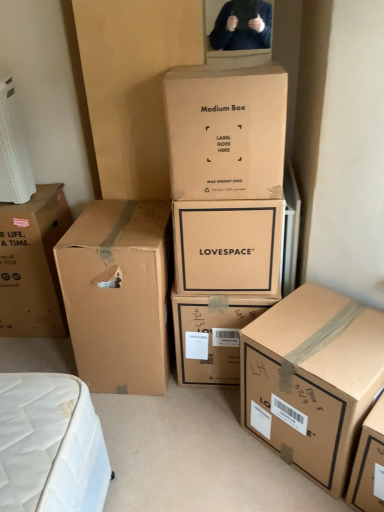
The image size is (384, 512). Identify the location of brown cardboard box at lower right, the 6th box from the left. (312, 380).

What do you see at coordinates (118, 294) in the screenshot? Image resolution: width=384 pixels, height=512 pixels. I see `brown cardboard box at left, arranged as the 2th box when viewed from the left` at bounding box center [118, 294].

Image resolution: width=384 pixels, height=512 pixels. Describe the element at coordinates (228, 246) in the screenshot. I see `matte cardboard box at center, the 4th box viewed from the left` at that location.

The width and height of the screenshot is (384, 512). Find the location of `matte brown box at center, which is the 5th box in left-to-right order`. matte brown box at center, which is the 5th box in left-to-right order is located at coordinates (212, 335).

This screenshot has height=512, width=384. I want to click on brown cardboard box at lower right, the 1th box from the right, so click(312, 380).

Considering the sizes of objects brown cardboard box at lower right, the 1th box from the right, and matte cardboard box at center, the 4th box viewed from the left, in the image provided, who is thinner, brown cardboard box at lower right, the 1th box from the right, or matte cardboard box at center, the 4th box viewed from the left,?

matte cardboard box at center, the 4th box viewed from the left.

Does brown cardboard box at lower right, the 1th box from the right, turn towards matte cardboard box at center, positioned as the third box in right-to-left order?

No, brown cardboard box at lower right, the 1th box from the right, is not turned towards matte cardboard box at center, positioned as the third box in right-to-left order.

Measure the distance between brown cardboard box at lower right, the 6th box from the left, and matte cardboard box at center, positioned as the third box in right-to-left order.

15.18 inches.

Between brown cardboard box at lower right, the 1th box from the right, and matte cardboard box at center, positioned as the third box in right-to-left order, which one is positioned in front?

brown cardboard box at lower right, the 1th box from the right.

Does brown cardboard box at left, which is the first box from left to right, appear on the left side of brown cardboard box at lower right, the 6th box from the left?

Yes.

From the image's perspective, is brown cardboard box at left, which is the first box from left to right, under brown cardboard box at lower right, the 1th box from the right?

Incorrect, from the image's perspective, brown cardboard box at left, which is the first box from left to right, is higher than brown cardboard box at lower right, the 1th box from the right.

Choose the correct answer: Is brown cardboard box at left, which is the first box from left to right, inside brown cardboard box at lower right, the 6th box from the left, or outside it?

brown cardboard box at left, which is the first box from left to right, is outside brown cardboard box at lower right, the 6th box from the left.

From a real-world perspective, count 2nd boxs upward from the brown cardboard box at lower right, the 6th box from the left, and point to it. Please provide its 2D coordinates.

[(32, 264)]

Which object is positioned more to the right, brown cardboard box at center, the third box in the left-to-right sequence, or brown cardboard box at left, arranged as the fifth box when viewed from the right?

Positioned to the right is brown cardboard box at center, the third box in the left-to-right sequence.

Would you say brown cardboard box at left, arranged as the 2th box when viewed from the left, is part of brown cardboard box at center, the third box in the left-to-right sequence,'s contents?

No, brown cardboard box at left, arranged as the 2th box when viewed from the left, is not a part of brown cardboard box at center, the third box in the left-to-right sequence.

Is brown cardboard box at center, the 4th box in the right-to-left sequence, positioned in front of brown cardboard box at left, arranged as the 2th box when viewed from the left?

Yes, it is in front of brown cardboard box at left, arranged as the 2th box when viewed from the left.

What are the coordinates of `box that is under the brown cardboard box at lower right, the 6th box from the left (from a real-world perspective)` in the screenshot? It's located at (212, 335).

Between brown cardboard box at lower right, the 1th box from the right, and matte brown box at center, which is the 5th box in left-to-right order, which one is positioned in front?

brown cardboard box at lower right, the 1th box from the right.

Is brown cardboard box at lower right, the 1th box from the right, far from matte brown box at center, which is the 5th box in left-to-right order?

No, there isn't a large distance between brown cardboard box at lower right, the 1th box from the right, and matte brown box at center, which is the 5th box in left-to-right order.

Considering the positions of objects brown cardboard box at lower right, the 6th box from the left, and matte brown box at center, the second box positioned from the right, in the image provided, who is more to the right, brown cardboard box at lower right, the 6th box from the left, or matte brown box at center, the second box positioned from the right,?

brown cardboard box at lower right, the 6th box from the left.

Is brown cardboard box at left, which is the first box from left to right, smaller than brown cardboard box at center, the 4th box in the right-to-left sequence?

No.

From a real-world perspective, is brown cardboard box at left, the sixth box viewed from the right, positioned under brown cardboard box at center, the 4th box in the right-to-left sequence, based on gravity?

Correct, in the physical world, brown cardboard box at left, the sixth box viewed from the right, is lower than brown cardboard box at center, the 4th box in the right-to-left sequence.

Can you tell me how much brown cardboard box at left, which is the first box from left to right, and brown cardboard box at center, the third box in the left-to-right sequence, differ in facing direction?

0.571 degrees.

Is brown cardboard box at left, which is the first box from left to right, not near brown cardboard box at center, the third box in the left-to-right sequence?

Yes.

Based on the photo, is matte brown box at center, which is the 5th box in left-to-right order, taller than brown cardboard box at lower right, the 6th box from the left?

Incorrect, the height of matte brown box at center, which is the 5th box in left-to-right order, is not larger of that of brown cardboard box at lower right, the 6th box from the left.

Is matte brown box at center, the second box positioned from the right, facing away from brown cardboard box at lower right, the 6th box from the left?

No, matte brown box at center, the second box positioned from the right, is not facing away from brown cardboard box at lower right, the 6th box from the left.

Can you tell me how much matte brown box at center, which is the 5th box in left-to-right order, and brown cardboard box at lower right, the 6th box from the left, differ in facing direction?

matte brown box at center, which is the 5th box in left-to-right order, and brown cardboard box at lower right, the 6th box from the left, are facing 40.8 degrees away from each other.

Which is correct: matte brown box at center, which is the 5th box in left-to-right order, is inside brown cardboard box at lower right, the 6th box from the left, or outside of it?

matte brown box at center, which is the 5th box in left-to-right order, cannot be found inside brown cardboard box at lower right, the 6th box from the left.

From their relative heights in the image, would you say brown cardboard box at left, arranged as the 2th box when viewed from the left, is taller or shorter than matte cardboard box at center, the 4th box viewed from the left?

In the image, brown cardboard box at left, arranged as the 2th box when viewed from the left, appears to be taller than matte cardboard box at center, the 4th box viewed from the left.

Does point (163, 317) appear closer or farther from the camera than point (238, 229)?

Clearly, point (163, 317) is more distant from the camera than point (238, 229).

The height and width of the screenshot is (512, 384). What are the coordinates of `the 2nd box located above the brown cardboard box at left, arranged as the fifth box when viewed from the right (from a real-world perspective)` in the screenshot? It's located at (228, 246).

The width and height of the screenshot is (384, 512). I want to click on the 2nd box behind the brown cardboard box at lower right, the 1th box from the right, counting from the anchor's position, so click(228, 246).

I want to click on the 3rd box above the brown cardboard box at lower right, the 6th box from the left (from the image's perspective), so click(x=32, y=264).

Looking at the image, which one is located closer to brown cardboard box at left, which is the first box from left to right, matte cardboard box at center, the 4th box viewed from the left, or brown cardboard box at left, arranged as the fifth box when viewed from the right?

Based on the image, brown cardboard box at left, arranged as the fifth box when viewed from the right, appears to be nearer to brown cardboard box at left, which is the first box from left to right.

From the image, which object appears to be farther from matte cardboard box at center, the 4th box viewed from the left, brown cardboard box at lower right, the 6th box from the left, or brown cardboard box at center, the 4th box in the right-to-left sequence?

brown cardboard box at lower right, the 6th box from the left, lies further to matte cardboard box at center, the 4th box viewed from the left, than the other object.

Based on their spatial positions, is brown cardboard box at center, the 4th box in the right-to-left sequence, or matte cardboard box at center, the 4th box viewed from the left, closer to matte brown box at center, which is the 5th box in left-to-right order?

Based on the image, matte cardboard box at center, the 4th box viewed from the left, appears to be nearer to matte brown box at center, which is the 5th box in left-to-right order.

When comparing their distances from matte brown box at center, the second box positioned from the right, does brown cardboard box at left, the sixth box viewed from the right, or brown cardboard box at left, arranged as the 2th box when viewed from the left, seem further?

brown cardboard box at left, the sixth box viewed from the right, lies further to matte brown box at center, the second box positioned from the right, than the other object.

Which object lies nearer to the anchor point brown cardboard box at left, the sixth box viewed from the right, brown cardboard box at left, arranged as the 2th box when viewed from the left, or matte cardboard box at center, the 4th box viewed from the left?

The object closer to brown cardboard box at left, the sixth box viewed from the right, is brown cardboard box at left, arranged as the 2th box when viewed from the left.

Based on their spatial positions, is brown cardboard box at left, arranged as the fifth box when viewed from the right, or matte brown box at center, the second box positioned from the right, closer to brown cardboard box at center, the 4th box in the right-to-left sequence?

brown cardboard box at left, arranged as the fifth box when viewed from the right, is positioned closer to the anchor brown cardboard box at center, the 4th box in the right-to-left sequence.

When comparing their distances from brown cardboard box at left, the sixth box viewed from the right, does brown cardboard box at center, the 4th box in the right-to-left sequence, or brown cardboard box at lower right, the 6th box from the left, seem further?

Among the two, brown cardboard box at lower right, the 6th box from the left, is located further to brown cardboard box at left, the sixth box viewed from the right.

Which object lies nearer to the anchor point brown cardboard box at lower right, the 1th box from the right, matte brown box at center, the second box positioned from the right, or matte cardboard box at center, positioned as the third box in right-to-left order?

matte brown box at center, the second box positioned from the right, is positioned closer to the anchor brown cardboard box at lower right, the 1th box from the right.

Locate an element on the screen. box between brown cardboard box at left, which is the first box from left to right, and brown cardboard box at center, the 4th box in the right-to-left sequence, from left to right is located at coordinates (118, 294).